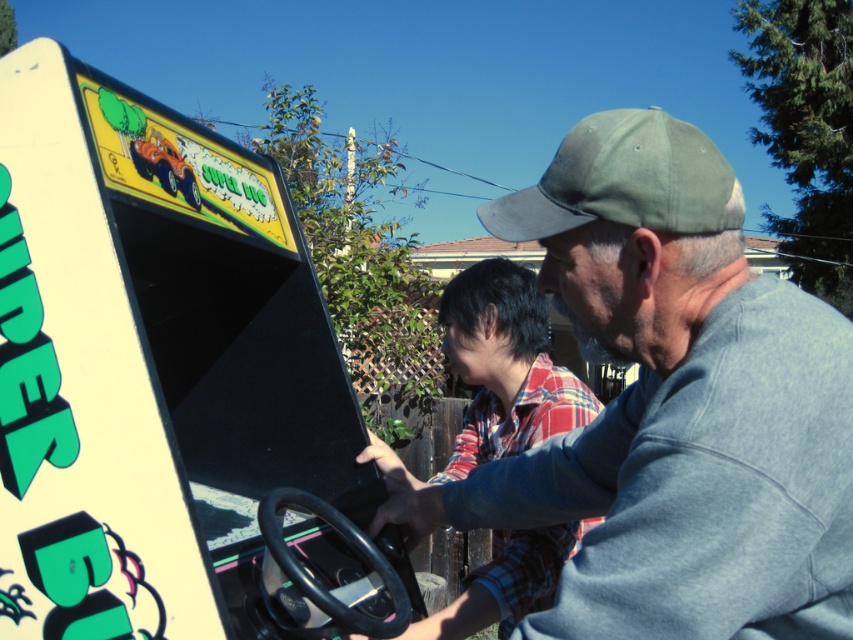
In the scene shown: You are designing a new game controller that needs to accommodate both the gray cotton shirt at center and the green fabric baseball cap at upper center. If the controller must be wider than both items to ensure comfortable use, what is the minimum width the controller should have based on the wider of the two?

The gray cotton shirt at center has a larger width than the green fabric baseball cap at upper center. Therefore, the controller must be wider than the gray cotton shirt at center to accommodate both items.

You are standing at the point marked by the coordinates point (x=672, y=406). Looking around, you see the gray cotton shirt at center. Which direction should you move to face the arcade machine with the red car illustration?

The point (x=672, y=406) marks the gray cotton shirt at center. Since the arcade machine is positioned in front of the gray cotton shirt at center, you should move forward to face the arcade machine with the red car illustration.

Consider the image. You are standing in front of the arcade machine and want to hand a flyer to the person wearing the gray cotton shirt at center. According to the image, where should you aim to place the flyer so they can easily reach it?

The gray cotton shirt at center is located at point (672,406), so you should aim to place the flyer near that coordinate for easy reach.